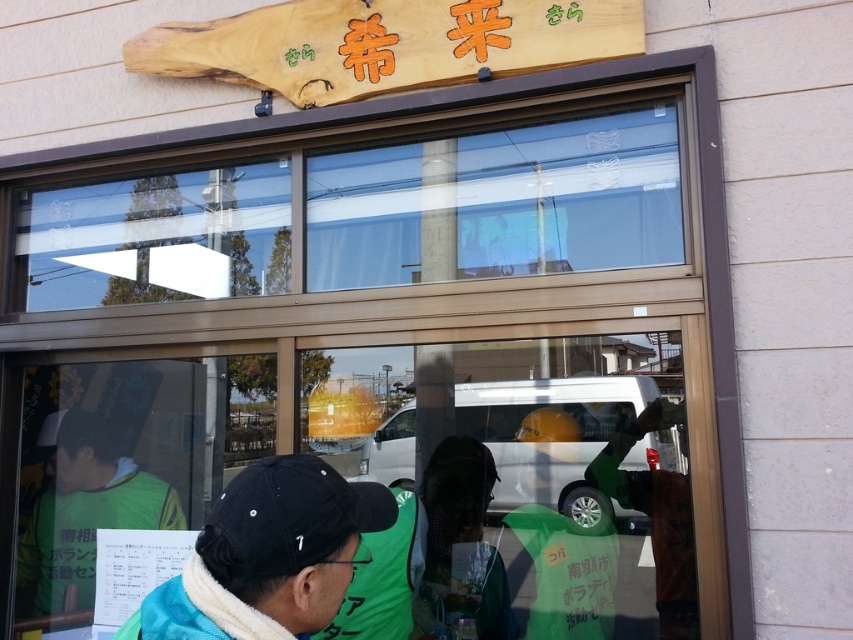
Is transparent glass window at center thinner than black matte baseball cap at center?

No, transparent glass window at center is not thinner than black matte baseball cap at center.

Locate an element on the screen. This screenshot has height=640, width=853. transparent glass window at center is located at coordinates (364, 216).

Which is in front, point (332, 211) or point (245, 529)?

Point (245, 529) is more forward.

The height and width of the screenshot is (640, 853). What are the coordinates of `transparent glass window at center` in the screenshot? It's located at click(364, 216).

Who is positioned more to the right, transparent glass window at center or green fabric vest at lower left?

transparent glass window at center

Which is in front, point (74, 216) or point (74, 544)?

Point (74, 216) is more forward.

Identify the location of transparent glass window at center. (364, 216).

Is black fabric cap at center positioned before black matte baseball cap at center?

Yes, it is.

Who is lower down, black fabric cap at center or black matte baseball cap at center?

black fabric cap at center is below.

This screenshot has width=853, height=640. I want to click on black fabric cap at center, so click(270, 554).

The width and height of the screenshot is (853, 640). Identify the location of black fabric cap at center. (270, 554).